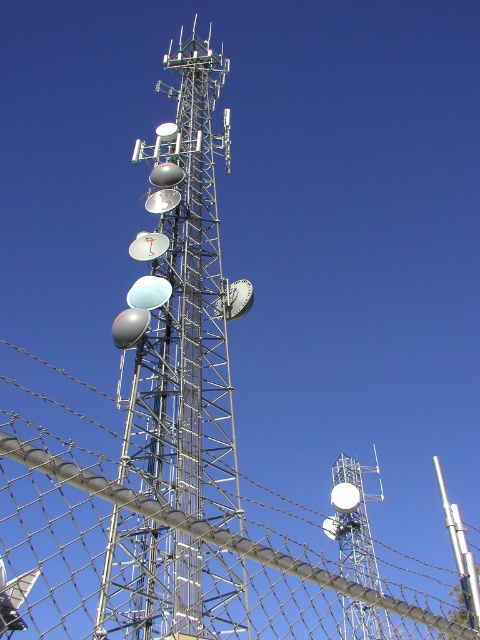
Question: Based on their relative distances, which object is farther from the wire mesh fence at center?

Choices:
 (A) silver metallic tower at center
 (B) metallic silver tower at center

Answer: (A)

Question: Which point appears farthest from the camera in this image?

Choices:
 (A) (344, 540)
 (B) (350, 536)

Answer: (A)

Question: Does metallic silver tower at center have a greater width compared to silver metallic tower at center?

Choices:
 (A) yes
 (B) no

Answer: (A)

Question: Which of the following is the closest to the observer?

Choices:
 (A) wire mesh fence at center
 (B) silver metallic tower at center
 (C) metallic silver tower at center

Answer: (A)

Question: Is wire mesh fence at center closer to camera compared to metallic silver tower at center?

Choices:
 (A) yes
 (B) no

Answer: (A)

Question: Is wire mesh fence at center to the left of metallic silver tower at center from the viewer's perspective?

Choices:
 (A) yes
 (B) no

Answer: (A)